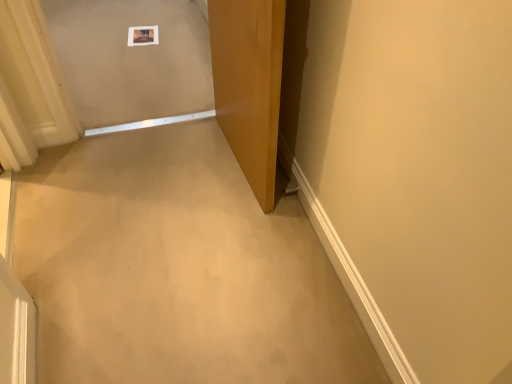
Find the location of a particular element. Image resolution: width=512 pixels, height=384 pixels. vacant space to the left of wooden door at center is located at coordinates (133, 183).